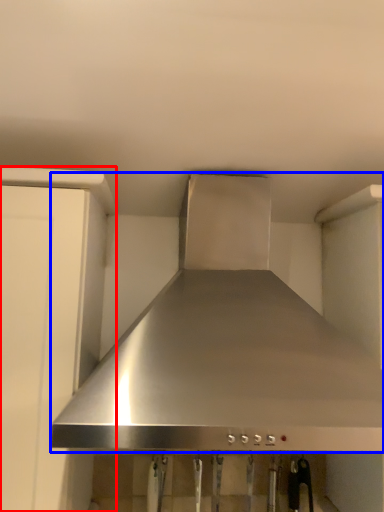
Question: Which point is further to the camera, cabinetry (highlighted by a red box) or home appliance (highlighted by a blue box)?

Choices:
 (A) cabinetry
 (B) home appliance

Answer: (A)